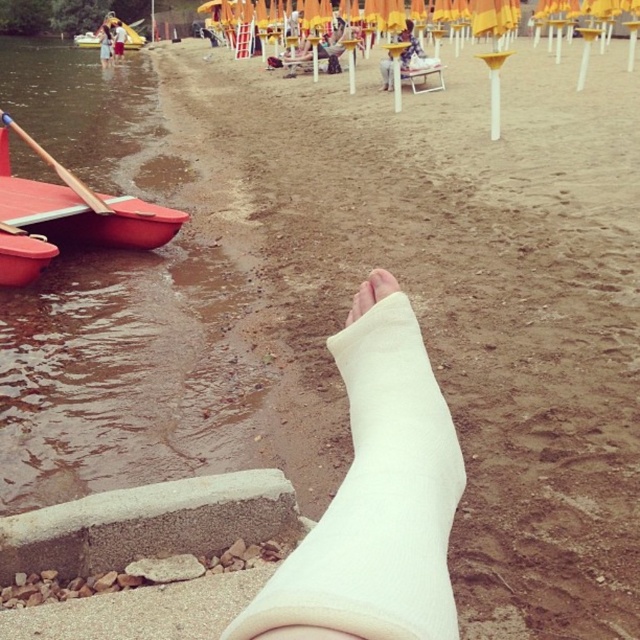
Who is lower down, white soft cast at center or white cast leg at lower center?

white soft cast at center is lower down.

Between point (388, 275) and point (99, 52), which one is positioned behind?

Point (99, 52)

Locate an element on the screen. white soft cast at center is located at coordinates [371, 292].

Can you confirm if beige sandy beach at center is positioned below white fabric cast at center?

Incorrect, beige sandy beach at center is not positioned below white fabric cast at center.

Does point (552, 624) come farther from viewer compared to point (376, 611)?

That is True.

Find the location of a particular element. The height and width of the screenshot is (640, 640). beige sandy beach at center is located at coordinates (460, 300).

Who is more distant from viewer, (400, 420) or (77, 38)?

The point (77, 38) is more distant.

Which of these two, white fabric cast at center or red plastic boat at upper left, stands taller?

With more height is red plastic boat at upper left.

Which is behind, point (307, 534) or point (109, 22)?

Point (109, 22)

Identify the location of white fabric cast at center. (376, 500).